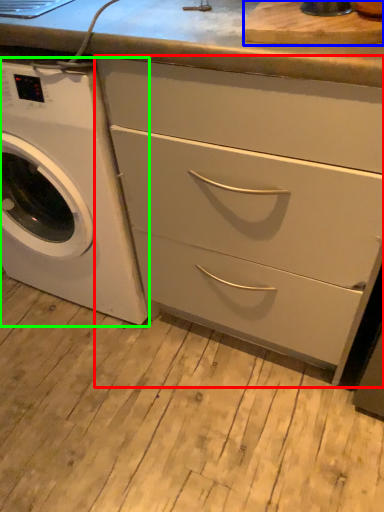
Question: Which object is positioned closest to chest of drawers (highlighted by a red box)? Select from cutting board (highlighted by a blue box) and washing machine (highlighted by a green box).

Choices:
 (A) cutting board
 (B) washing machine

Answer: (B)